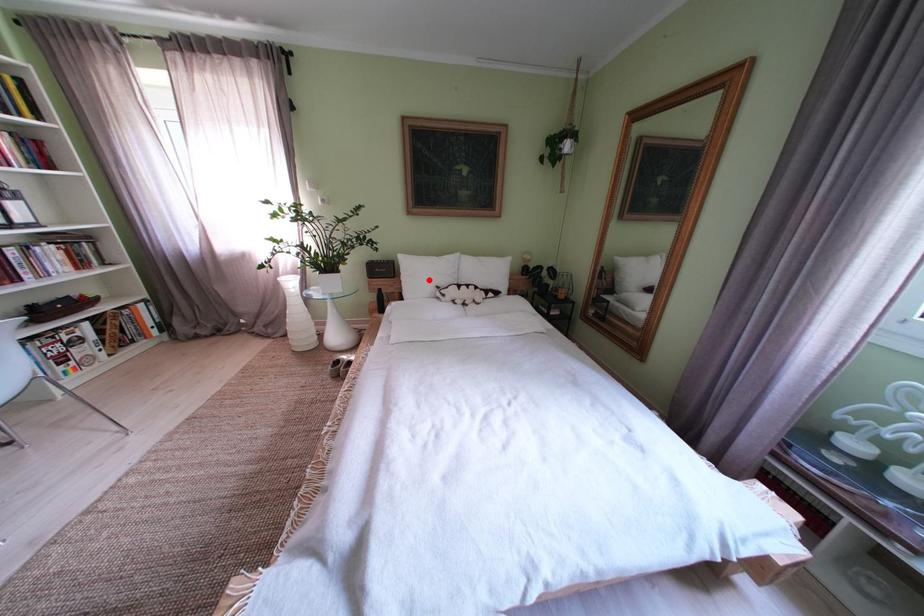
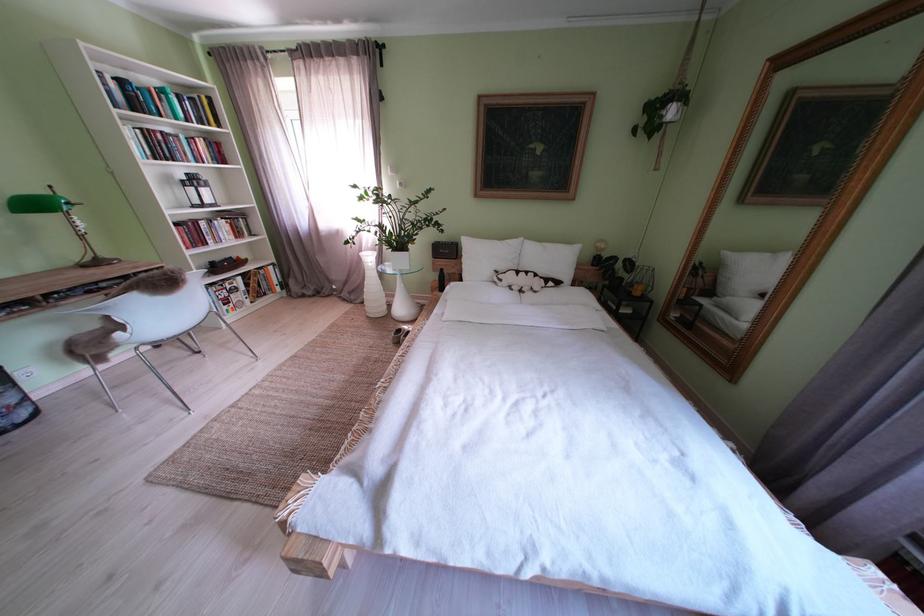
Where in the second image is the point corresponding to the highlighted location from the first image?

(490, 262)